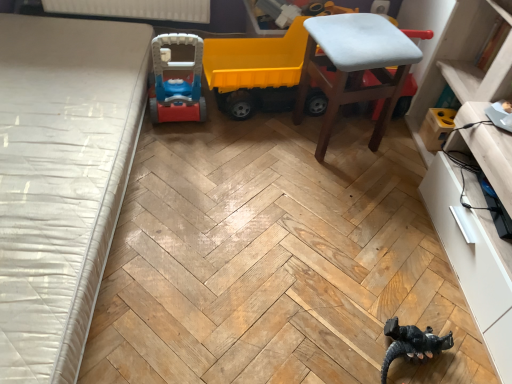
Identify the location of vacant area that lies between yellow plastic toy truck at center and black matte toy dinosaur at lower right. This screenshot has width=512, height=384. (314, 210).